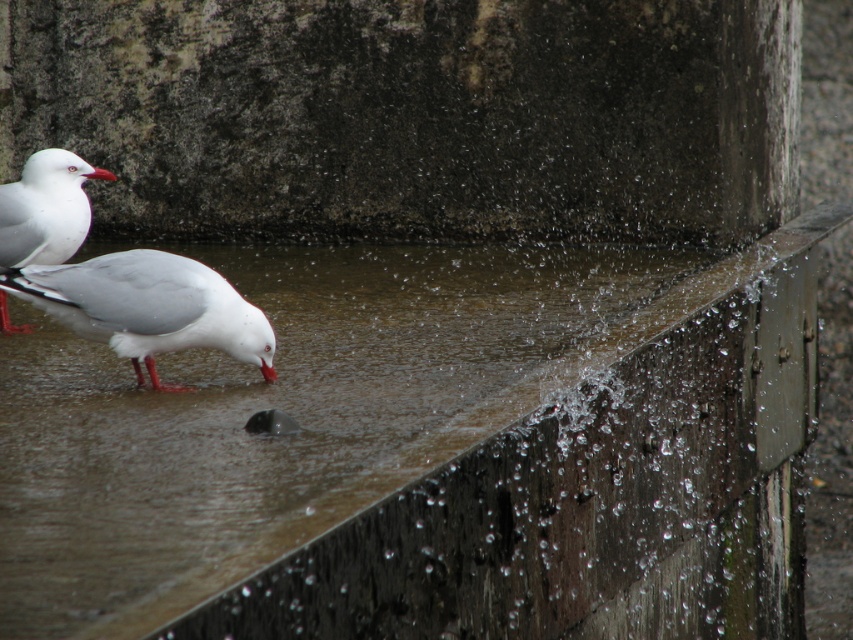
Question: Can you confirm if white matte bird at lower left is thinner than white matte/glossy seagull at left?

Choices:
 (A) yes
 (B) no

Answer: (B)

Question: Is white matte bird at lower left positioned at the back of white matte/glossy seagull at left?

Choices:
 (A) no
 (B) yes

Answer: (A)

Question: Can you confirm if white matte bird at lower left is positioned above white matte/glossy seagull at left?

Choices:
 (A) no
 (B) yes

Answer: (A)

Question: Which point is farther to the camera?

Choices:
 (A) white matte bird at lower left
 (B) white matte/glossy seagull at left

Answer: (B)